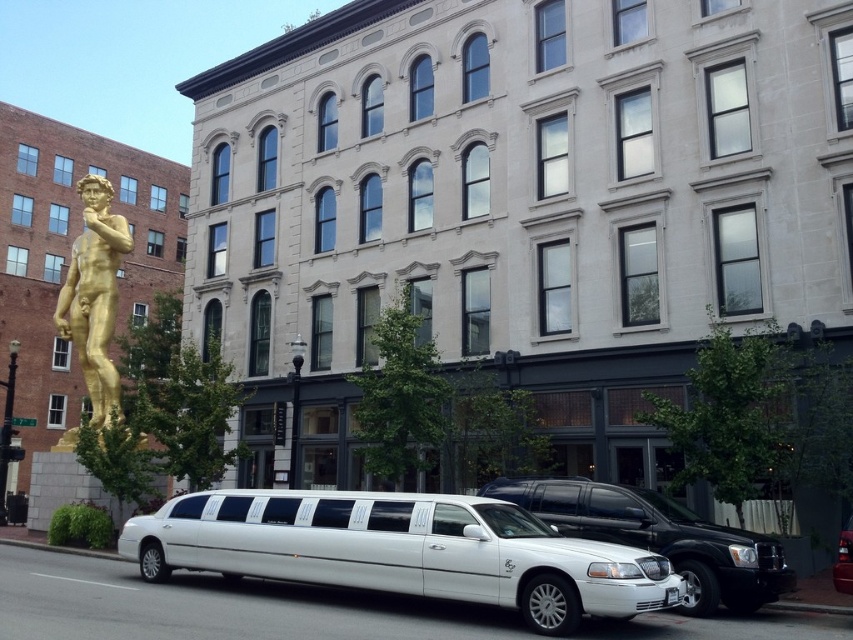
You are a delivery driver who needs to park your van between the white glossy limousine at lower center and the white metallic limousine at center. Your van is 6 meters long. Is there enough space between them for your van?

The distance between the white glossy limousine at lower center and the white metallic limousine at center is 11.20 meters. Since your van is 6 meters long, there is sufficient space to park between them.

You are a photographer trying to capture the gold polished statue at left and the white metallic limousine at center in a single shot. Based on their positions, will the statue appear in front of or behind the limousine in the photo?

The gold polished statue at left is positioned over the white metallic limousine at center, so in the photo, the statue will appear in front of the limousine.

You are a photographer trying to capture the gold polished statue at left without including the white glossy limousine at lower center in the frame. Is the statue positioned above or below the limousine?

The gold polished statue at left is positioned above the white glossy limousine at lower center, so you can aim your camera upwards to capture the statue without including the limousine in the frame.